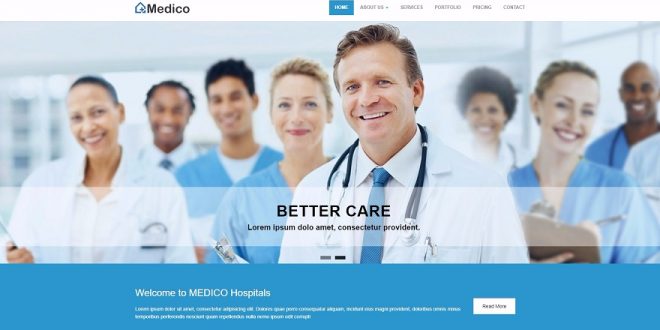
The height and width of the screenshot is (330, 660). I want to click on white ceiling, so click(x=133, y=53).